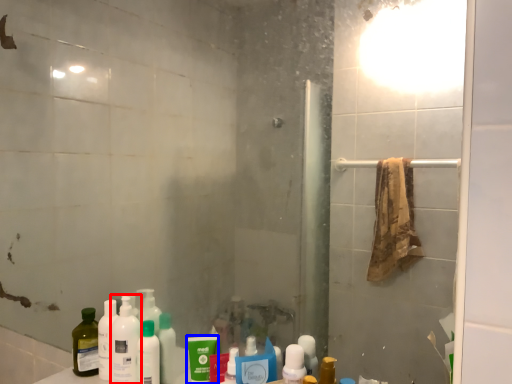
Question: Which object appears closest to the camera in this image, cleaning product (highlighted by a red box) or mouthwash (highlighted by a blue box)?

Choices:
 (A) cleaning product
 (B) mouthwash

Answer: (B)